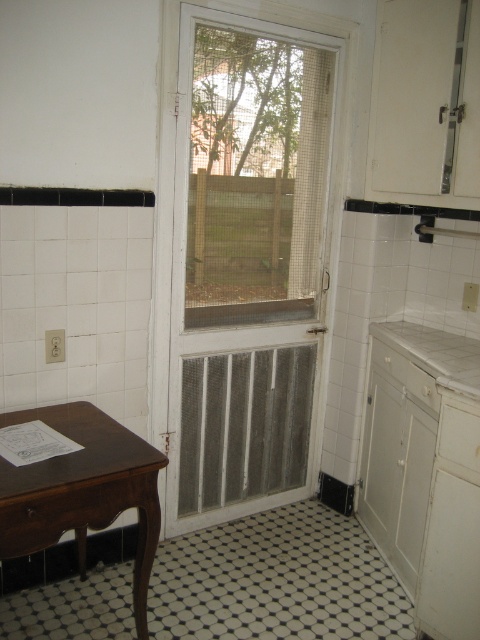
You are a delivery person trying to place a small package on the nearest available surface. The white mesh screen door at center is slightly ajar, and the white laminate countertop at right is cluttered with dishes. Which surface should you choose?

The white laminate countertop at right is cluttered with dishes, so you should choose the white mesh screen door at center as the nearest available surface since it is to the left of the countertop and likely has space.

In the scene shown: You are standing in the kitchen and need to place a 6 feet long tablecloth on the brown wood table at lower left. Can you determine if the tablecloth will reach the floor?

The distance between the brown wood table at lower left and the viewer is 5.18 feet. Since the tablecloth is longer than this distance, it will likely reach the floor.